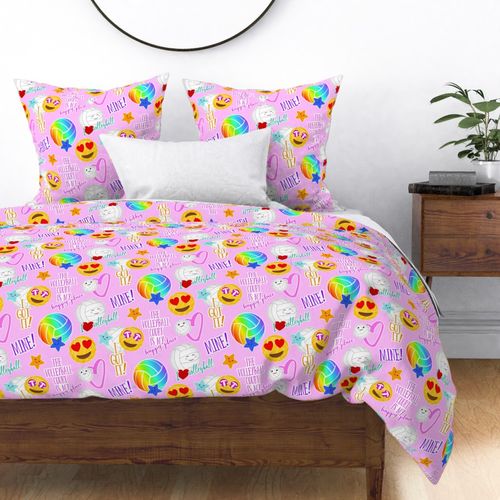
Where is `comforter`? This screenshot has width=500, height=500. comforter is located at coordinates (309, 280).